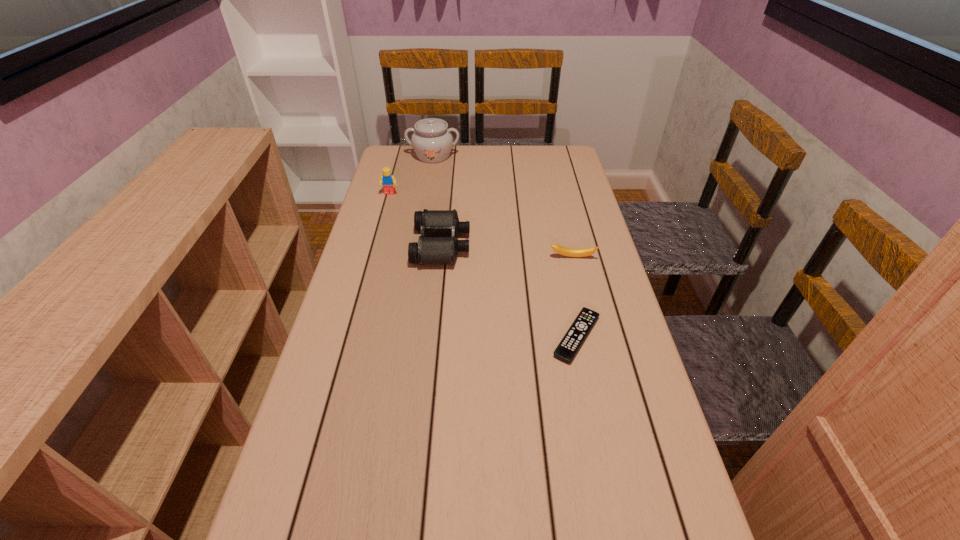
Find the location of a particular element. The height and width of the screenshot is (540, 960). the farthest object is located at coordinates pos(432,142).

Locate an element on the screen. This screenshot has width=960, height=540. the tallest object is located at coordinates (432, 142).

This screenshot has width=960, height=540. Find the location of `Lego`. Lego is located at coordinates (388, 181).

At what (x,y) coordinates should I click in order to perform the action: click on the fourth shortest object. Please return your answer as a coordinate pair (x, y). Looking at the image, I should click on (388, 181).

You are a GUI agent. You are given a task and a screenshot of the screen. Output one action in this format:
    pyautogui.click(x=<x>, y=<y>)
    Task: Click on the binoculars
    
    Given the screenshot: What is the action you would take?
    pyautogui.click(x=429, y=250)

Where is `banana`? banana is located at coordinates (571, 252).

Where is `the shortest object`? the shortest object is located at coordinates (571, 342).

You are a GUI agent. You are given a task and a screenshot of the screen. Output one action in this format:
    pyautogui.click(x=<x>, y=<y>)
    Task: Click on the nearest object
    The height and width of the screenshot is (540, 960).
    Given the screenshot: What is the action you would take?
    pyautogui.click(x=571, y=342)

Locate an element on the screen. vacant region located 0.090m on the right of the tallest object is located at coordinates (483, 156).

Identify the location of free location located 0.350m on the front-facing side of the second tallest object. (371, 263).